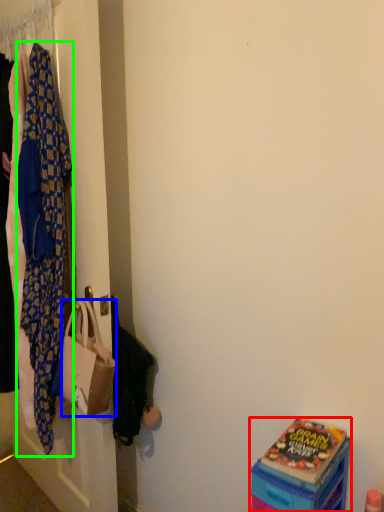
Question: Based on their relative distances, which object is nearer to box (highlighted by a red box)? Choose from handbag (highlighted by a blue box) and blanket (highlighted by a green box).

Choices:
 (A) handbag
 (B) blanket

Answer: (A)